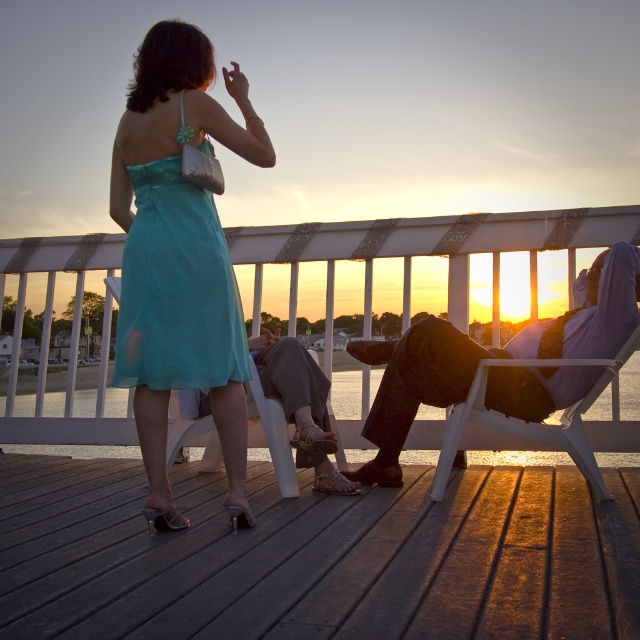
Question: Which point is closer to the camera taking this photo?

Choices:
 (A) (232, 93)
 (B) (115, 380)
 (C) (512, 426)

Answer: (B)

Question: Is the position of teal satin dress at center more distant than that of white plastic beach chair at right?

Choices:
 (A) no
 (B) yes

Answer: (A)

Question: Is teal satin dress at center to the left of leather sandal at lower center from the viewer's perspective?

Choices:
 (A) yes
 (B) no

Answer: (A)

Question: Among these points, which one is farthest from the camera?

Choices:
 (A) (346, 467)
 (B) (170, 148)
 (C) (90, 566)
 (D) (477, 368)

Answer: (A)

Question: Which object is the farthest from the wooden at lower center?

Choices:
 (A) white plastic beach chair at right
 (B) teal chiffon dress at center
 (C) matte black pants at right
 (D) teal satin dress at center

Answer: (D)

Question: Is wooden at lower center above leather sandal at lower center?

Choices:
 (A) no
 (B) yes

Answer: (A)